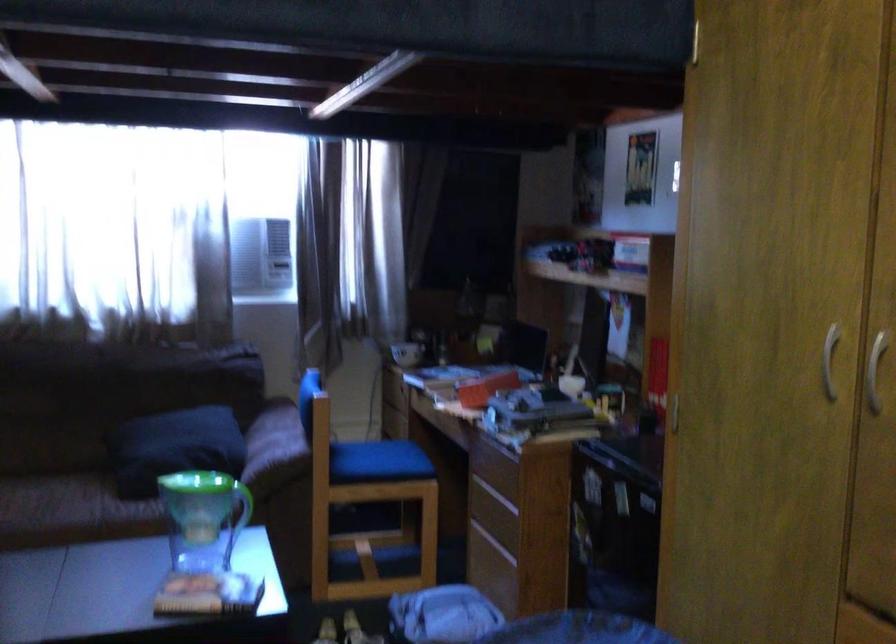
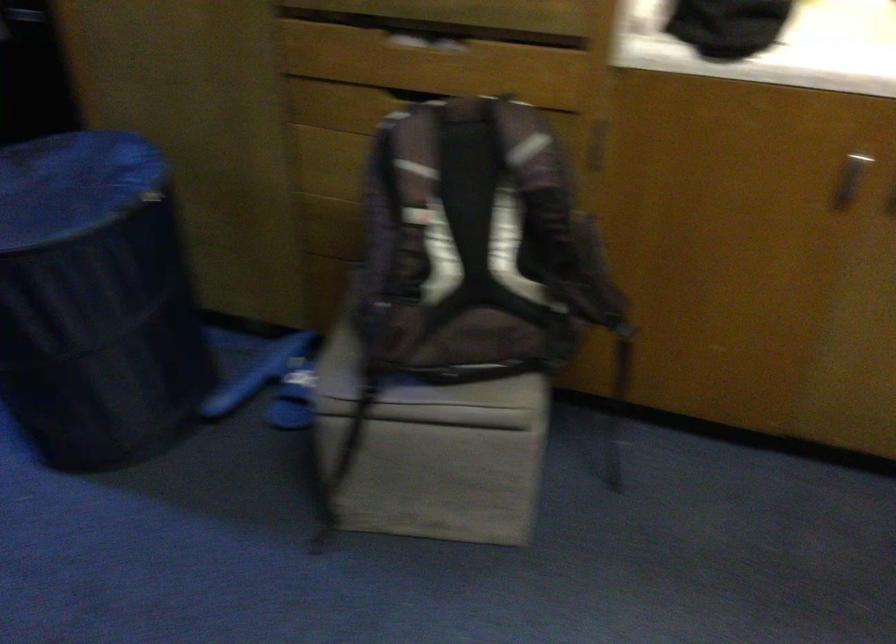
In the scene shown: How did the camera likely rotate?

The camera rotated toward right-down.